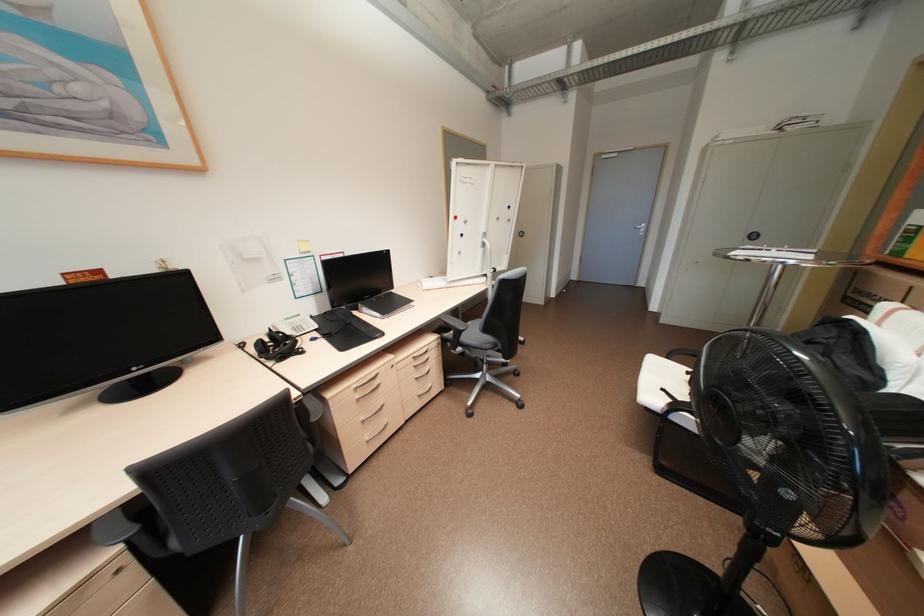
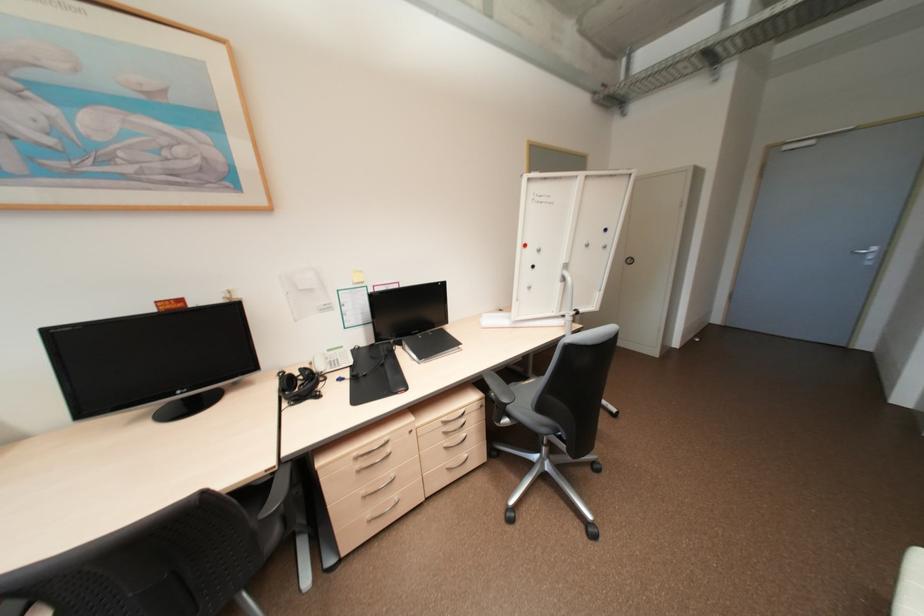
Locate, in the second image, the point that corresponds to pixel 468 235 in the first image.

(539, 265)